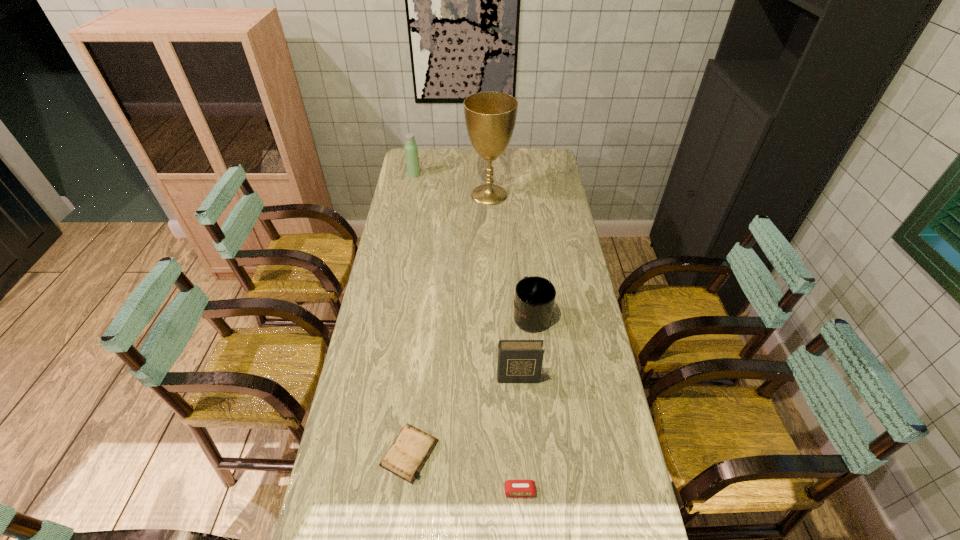
This screenshot has width=960, height=540. Find the location of `the tallest object`. the tallest object is located at coordinates (490, 117).

You are a GUI agent. You are given a task and a screenshot of the screen. Output one action in this format:
    pyautogui.click(x=<x>, y=<y>)
    Task: Click on the trophy cup
    
    Given the screenshot: What is the action you would take?
    pyautogui.click(x=490, y=117)

This screenshot has width=960, height=540. What are the coordinates of `the leftmost object` in the screenshot? It's located at (411, 150).

Identify the location of the farthest object. (411, 150).

Identify the location of the fourth farthest object. (519, 361).

Find the location of `the taller diary`. the taller diary is located at coordinates (519, 361).

Where is `mug`? The image size is (960, 540). mug is located at coordinates (534, 299).

What are the coordinates of `the fourth nearest object` in the screenshot? It's located at (534, 299).

Locate an element on the screen. the fifth tallest object is located at coordinates (513, 488).

The width and height of the screenshot is (960, 540). Identify the location of alarm clock. (513, 488).